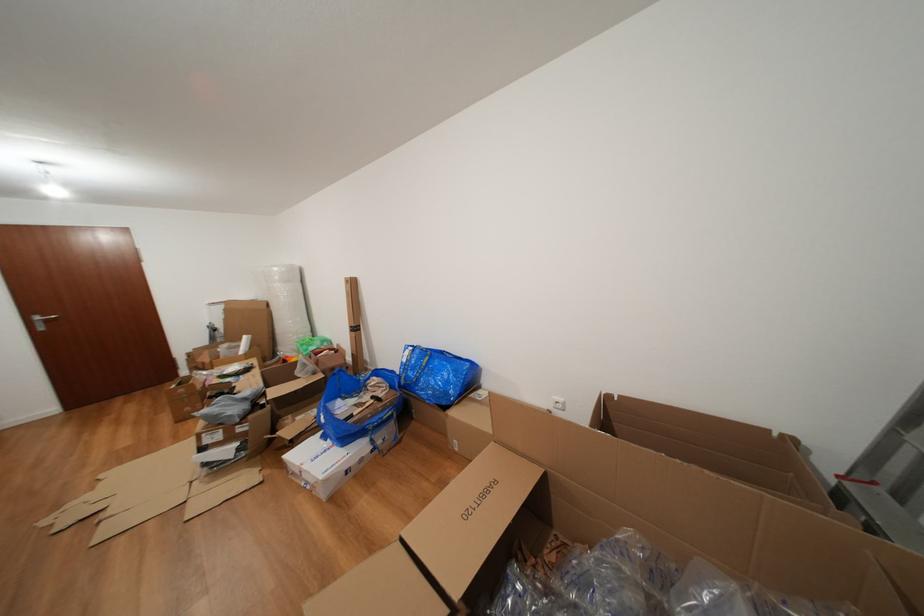
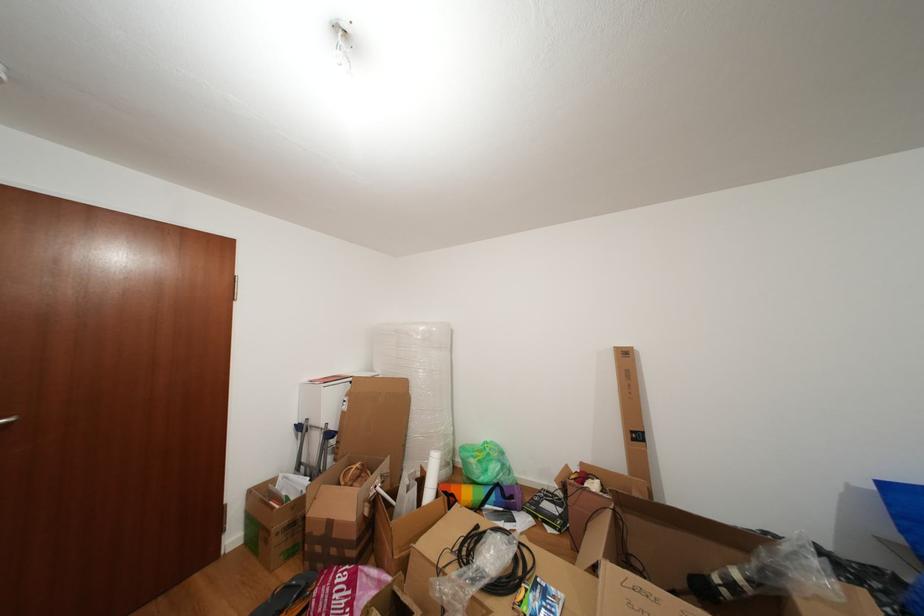
Find the pixel in the second image that matches (314,355) in the first image.

(494, 476)